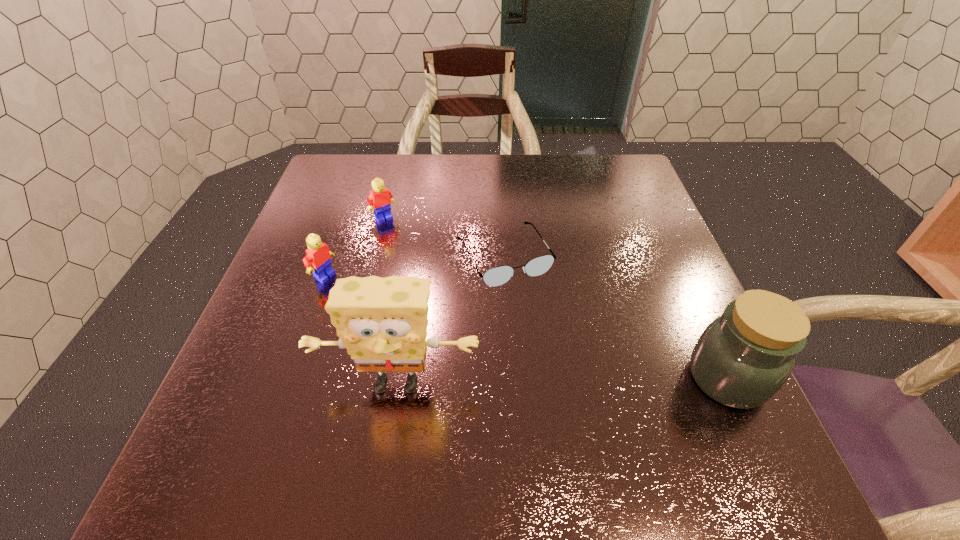
You are a GUI agent. You are given a task and a screenshot of the screen. Output one action in this format:
    pyautogui.click(x=<x>, y=<y>)
    Task: Click on the vacant point located between the shortest object and the sponge
    The image size is (960, 540).
    Given the screenshot: What is the action you would take?
    pyautogui.click(x=450, y=319)

What are the coordinates of `free area in between the shortest object and the tallest object` in the screenshot? It's located at (450, 319).

The width and height of the screenshot is (960, 540). I want to click on object that ranks as the third closest to the tallest object, so click(x=741, y=360).

Image resolution: width=960 pixels, height=540 pixels. Find the location of `the fourth closest object to the spectacles`. the fourth closest object to the spectacles is located at coordinates (318, 256).

The width and height of the screenshot is (960, 540). Identify the location of vacant space that satisfies the following two spatial constraints: 1. on the front side of the rightmost object; 2. on the right side of the nearer Lego. (289, 378).